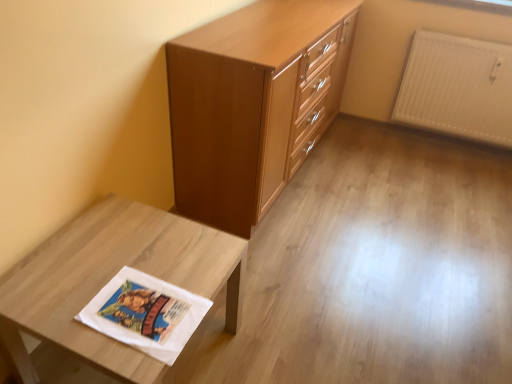
Locate an element on the screen. Image resolution: width=512 pixels, height=384 pixels. blank space situated above white matte fabric at lower left (from a real-world perspective) is located at coordinates (124, 269).